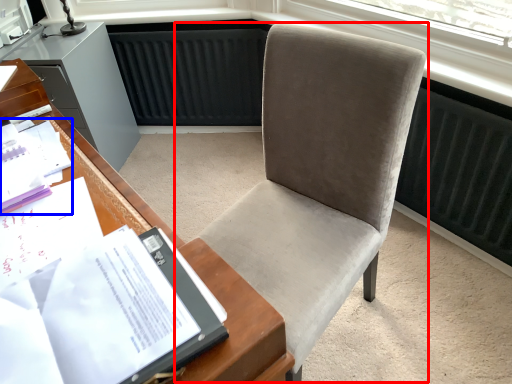
Question: Which point is further to the camera, chair (highlighted by a red box) or book (highlighted by a blue box)?

Choices:
 (A) chair
 (B) book

Answer: (B)